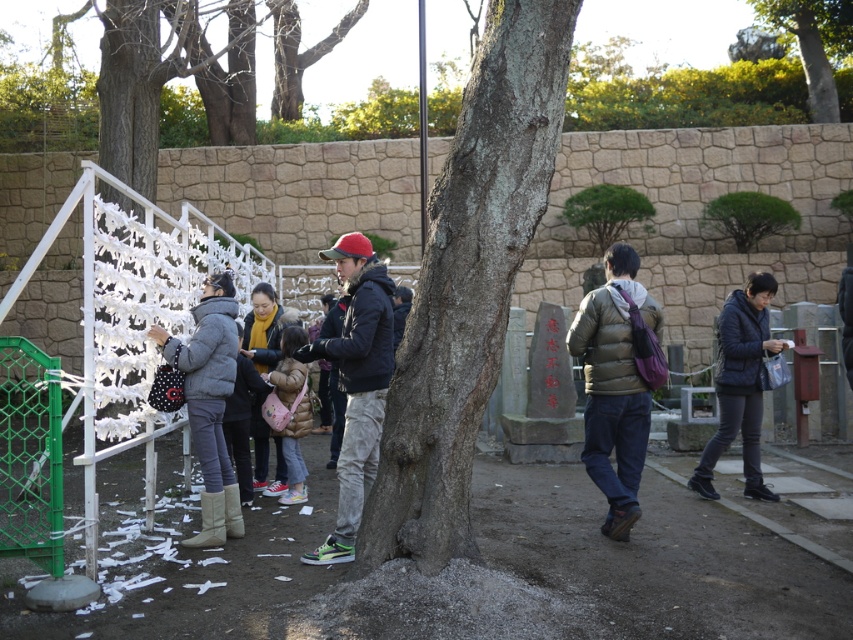
What do you see at coordinates (740, 385) in the screenshot?
I see `dark blue quilted jacket at lower right` at bounding box center [740, 385].

Between point (715, 458) and point (846, 19), which one is positioned in front?

Point (715, 458)

Locate an element on the screen. The height and width of the screenshot is (640, 853). dark blue quilted jacket at lower right is located at coordinates (740, 385).

How distant is smooth brown bark at center from gray woolen coat at left?

A distance of 2.09 meters exists between smooth brown bark at center and gray woolen coat at left.

Does smooth brown bark at center have a larger size compared to gray woolen coat at left?

Indeed, smooth brown bark at center has a larger size compared to gray woolen coat at left.

Consider the image. Who is more forward, [524,147] or [164,339]?

Point [524,147] is in front.

You are a GUI agent. You are given a task and a screenshot of the screen. Output one action in this format:
    pyautogui.click(x=<x>, y=<y>)
    Task: Click on the smooth brown bark at center
    
    Given the screenshot: What is the action you would take?
    pyautogui.click(x=468, y=284)

Can you confirm if smooth brown bark at center is positioned below matte pink fabric bag at center?

No.

Where is `smooth brown bark at center`? This screenshot has width=853, height=640. smooth brown bark at center is located at coordinates (468, 284).